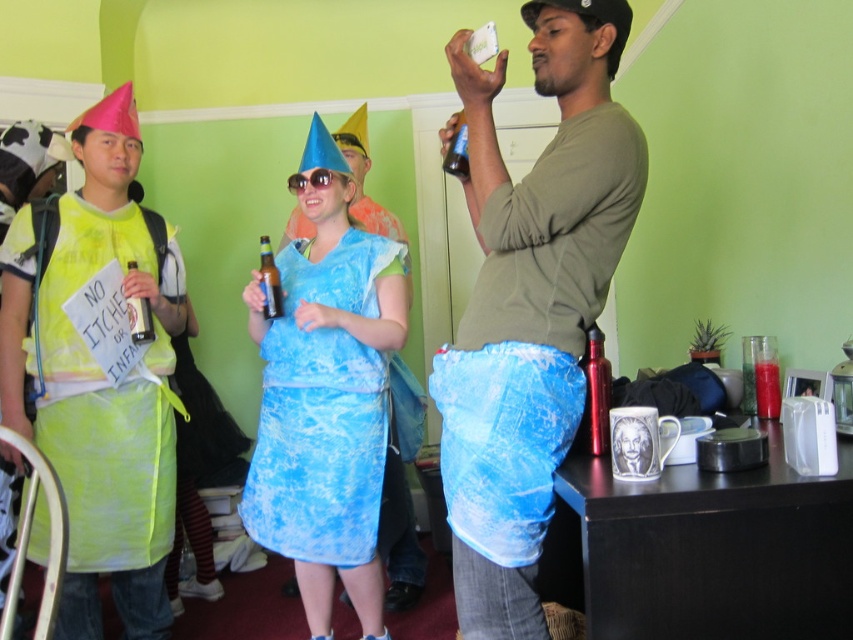
Question: Considering the relative positions of yellow fabric apron at left and blue tie-dye dress at center in the image provided, where is yellow fabric apron at left located with respect to blue tie-dye dress at center?

Choices:
 (A) below
 (B) above

Answer: (B)

Question: Which point is farther from the camera taking this photo?

Choices:
 (A) (106, 509)
 (B) (473, 390)

Answer: (A)

Question: Considering the real-world distances, which object is farthest from the blue tie-dye dress at center?

Choices:
 (A) blue denim shorts at center
 (B) yellow fabric apron at left

Answer: (A)

Question: From the image, what is the correct spatial relationship of blue denim shorts at center in relation to blue tie-dye dress at center?

Choices:
 (A) left
 (B) right

Answer: (B)

Question: Where is blue denim shorts at center located in relation to blue tie-dye dress at center in the image?

Choices:
 (A) right
 (B) left

Answer: (A)

Question: Which of the following is the farthest from the observer?

Choices:
 (A) yellow fabric apron at left
 (B) blue denim shorts at center

Answer: (A)